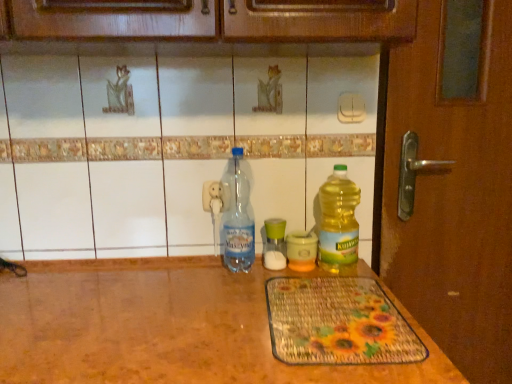
Question: Relative to transparent plastic bottle at center, which appears as the fourth bottle when viewed from the right, is green glass jar at center, which is the 3th bottle from right to left, in front or behind?

Choices:
 (A) front
 (B) behind

Answer: (B)

Question: Is green glass jar at center, arranged as the 2th bottle when viewed from the left, taller or shorter than transparent plastic bottle at center, which appears as the 1th bottle when viewed from the left?

Choices:
 (A) short
 (B) tall

Answer: (A)

Question: Which object is positioned farthest from the green glass jar at center, arranged as the 2th bottle when viewed from the left?

Choices:
 (A) translucent plastic bottle at right, which appears as the fourth bottle when viewed from the left
 (B) yellow translucent bottle at center, the second bottle positioned from the right
 (C) transparent plastic bottle at center, which appears as the 1th bottle when viewed from the left

Answer: (A)

Question: Which object is the closest to the green glass jar at center, which is the 3th bottle from right to left?

Choices:
 (A) translucent plastic bottle at right, which appears as the fourth bottle when viewed from the left
 (B) yellow translucent bottle at center, the second bottle positioned from the right
 (C) transparent plastic bottle at center, which appears as the 1th bottle when viewed from the left

Answer: (B)